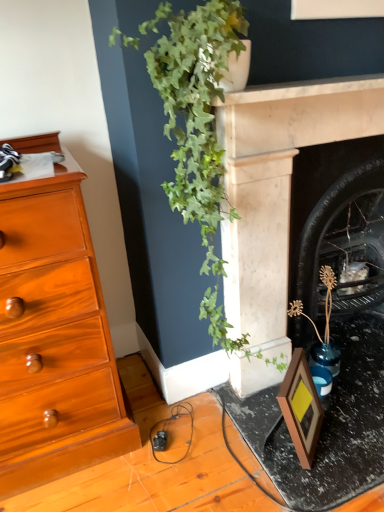
Question: Is matte black frame at lower right bigger or smaller than wooden picture frame at lower right?

Choices:
 (A) small
 (B) big

Answer: (B)

Question: Considering their positions, is matte black frame at lower right located in front of or behind wooden picture frame at lower right?

Choices:
 (A) behind
 (B) front

Answer: (B)

Question: Estimate the real-world distances between objects in this image. Which object is closer to the wooden picture frame at lower right?

Choices:
 (A) marble fireplace at center-right, which is the 1th fireplace in front-to-back order
 (B) matte black frame at lower right
 (C) black marble fireplace at center-right, which is the second fireplace in front-to-back order
 (D) green leafy plant at upper center

Answer: (B)

Question: Estimate the real-world distances between objects in this image. Which object is closer to the marble fireplace at center-right, which is the 1th fireplace in front-to-back order?

Choices:
 (A) green leafy plant at upper center
 (B) wooden picture frame at lower right
 (C) black marble fireplace at center-right, marked as the 1th fireplace in a back-to-front arrangement
 (D) matte black frame at lower right

Answer: (A)